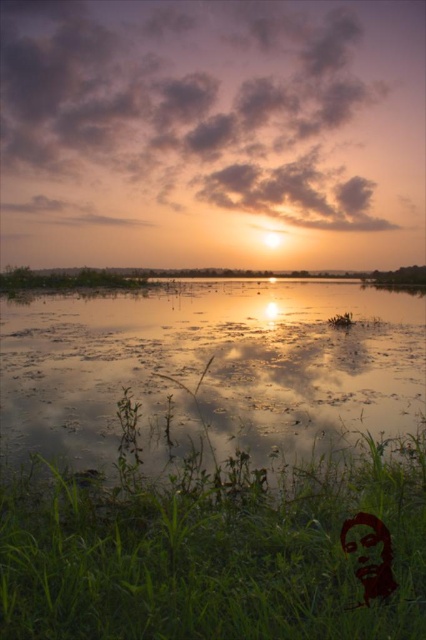
You are standing on the shore of the lake and see the translucent reflective water at center and the silhouette paper person at lower right. Which object is closer to the right edge of the image?

The silhouette paper person at lower right is positioned on the left side of the translucent reflective water at center, so the translucent reflective water at center is closer to the right edge of the image.

You are a small robot with a width of 1 meter. You are positioned near the green grass at lower left and want to reach the translucent reflective water at center. Can you move directly to the water without encountering any obstacles?

The distance between the green grass at lower left and the translucent reflective water at center is 5.54 meters. Since there are no obstacles mentioned in the scene description, the robot can move directly to the water.